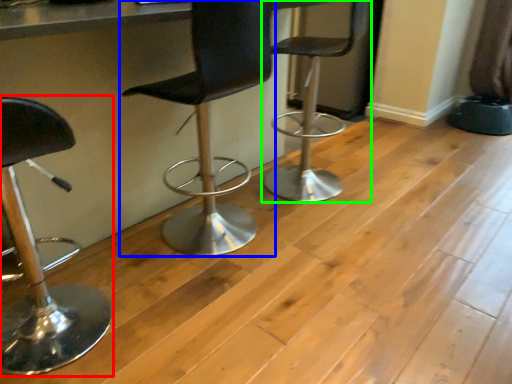
Question: Which object is positioned closest to chair (highlighted by a red box)? Select from chair (highlighted by a blue box) and chair (highlighted by a green box).

Choices:
 (A) chair
 (B) chair

Answer: (A)